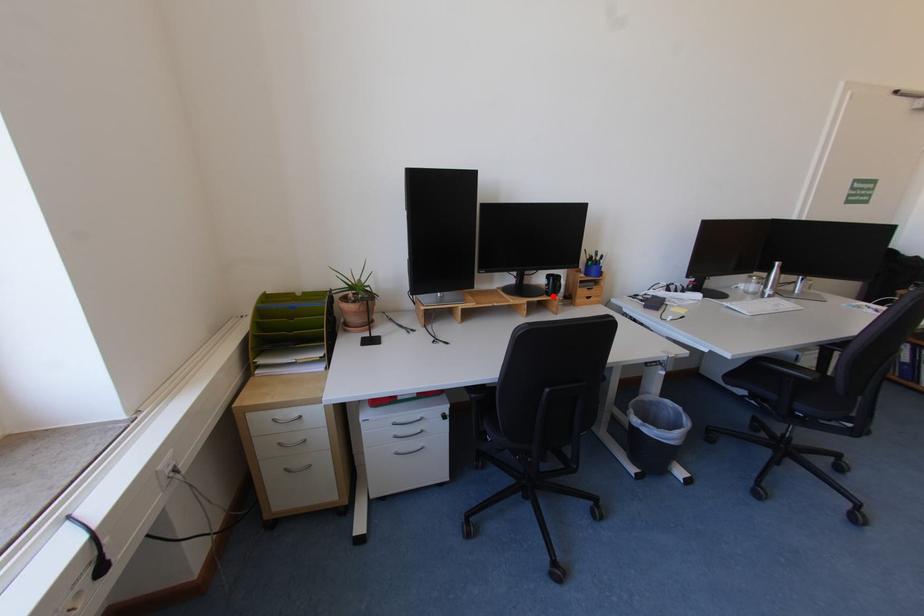
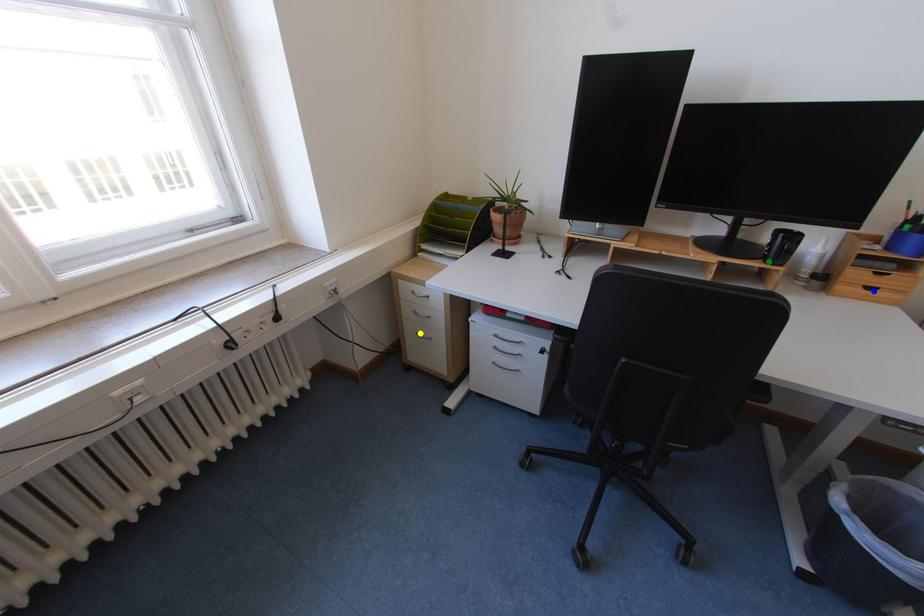
Question: I am providing you with two images of the same scene from different viewpoints. A red point is marked on the first image. You are given multiple points on the second image. Which point in image 2 represents the same 3d spot as the red point in image 1?

Choices:
 (A) blue point
 (B) green point
 (C) yellow point

Answer: (B)